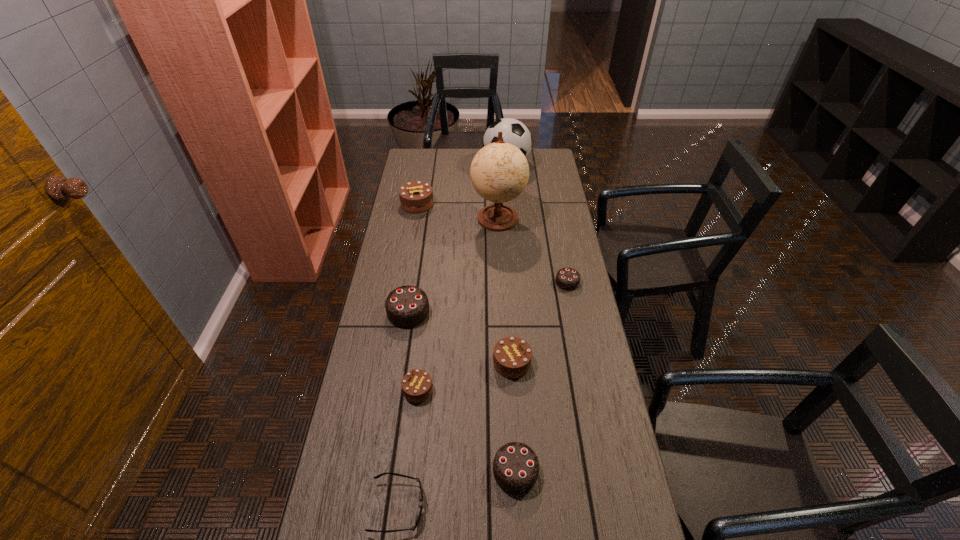
Locate an element on the screen. vacant space situated 0.220m on the front of the rightmost brown chocolate cake is located at coordinates click(517, 449).

You are a GUI agent. You are given a task and a screenshot of the screen. Output one action in this format:
    pyautogui.click(x=<x>, y=<y>)
    Task: Click on the free space located 0.070m on the right of the nearest chocolate cake
    
    Given the screenshot: What is the action you would take?
    pyautogui.click(x=564, y=471)

Find the location of a particular element. free spot located 0.310m on the right of the smallest brown chocolate cake is located at coordinates (536, 390).

Identify the location of vacant space situated 0.180m on the left of the rightmost object. click(x=507, y=282).

Where is `vacant space located on the lenses of the sunglasses`? The image size is (960, 540). vacant space located on the lenses of the sunglasses is located at coordinates (533, 507).

Identify the location of object located in the far edge section of the desktop. The width and height of the screenshot is (960, 540). (515, 132).

Find the location of a particular element. This screenshot has height=540, width=960. sunglasses present at the left edge is located at coordinates (413, 528).

The height and width of the screenshot is (540, 960). Identify the location of soccer ball located at the right edge. (515, 132).

I want to click on chocolate cake that is at the right edge, so click(568, 279).

At what (x,y) coordinates should I click in order to perform the action: click on object present at the far right corner. Please return your answer as a coordinate pair (x, y). Looking at the image, I should click on (515, 132).